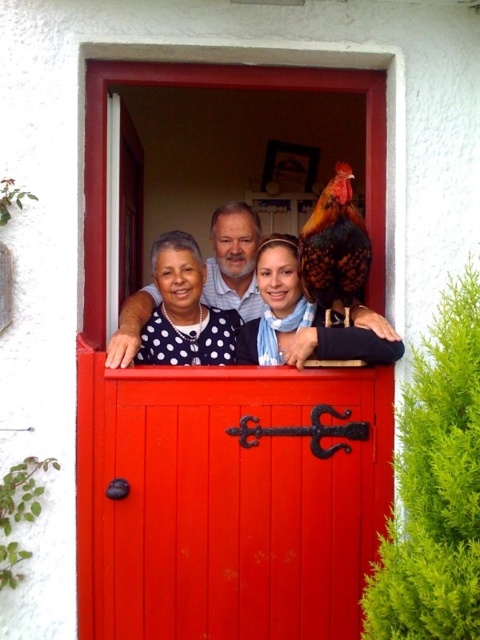
You are standing in front of the house and want to touch both the smooth glossy wood door at center and the matte black scarf at center. Which object will you need to reach out further to touch?

The matte black scarf at center is further away from you than the smooth glossy wood door at center, so you will need to reach out further to touch the matte black scarf at center.

You are a painter who needs to cover both the smooth glossy wood door at center and the matte black scarf at center with paint. Which object requires more paint due to its larger size?

The matte black scarf at center requires more paint because it is larger than the smooth glossy wood door at center.